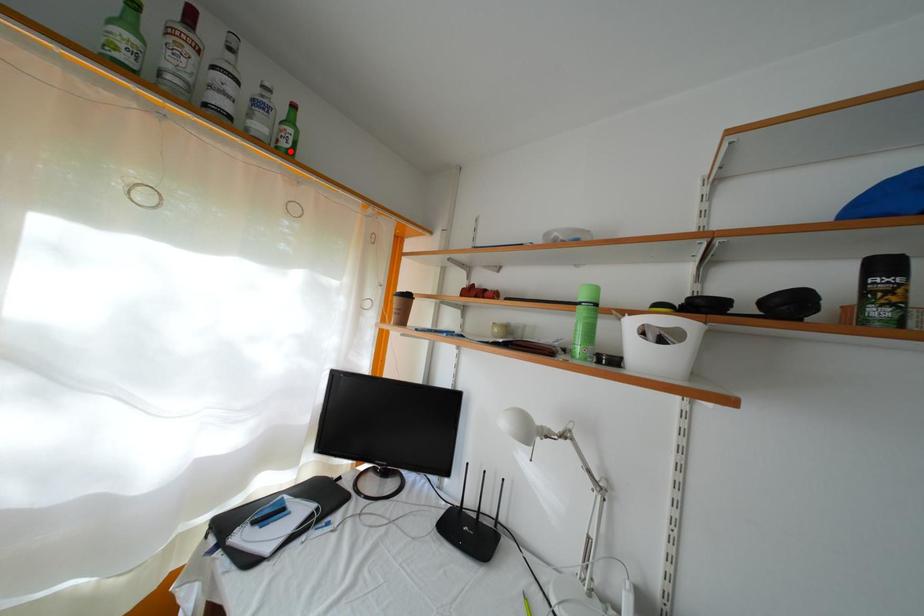
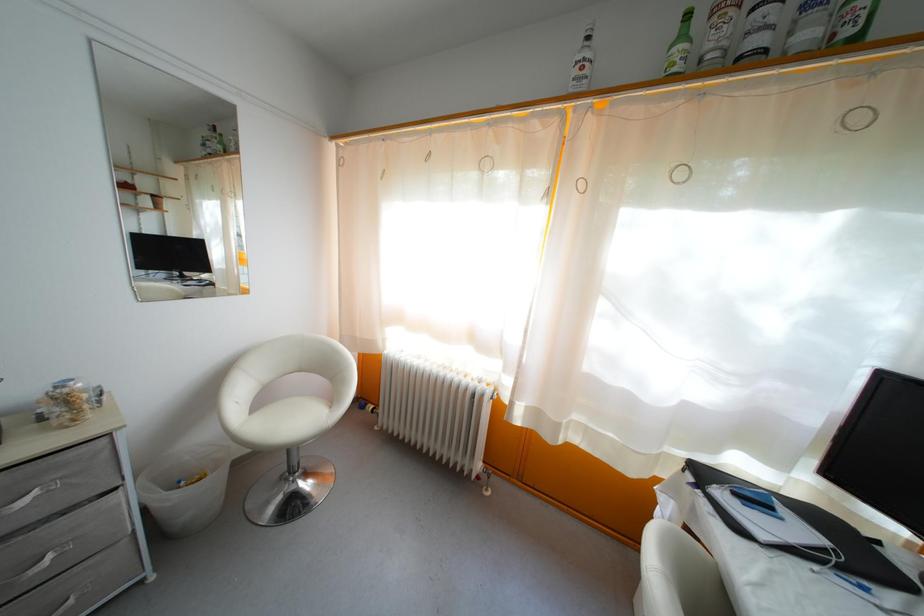
Where in the second image is the point corresponding to the highlighted location from the first image?

(854, 39)